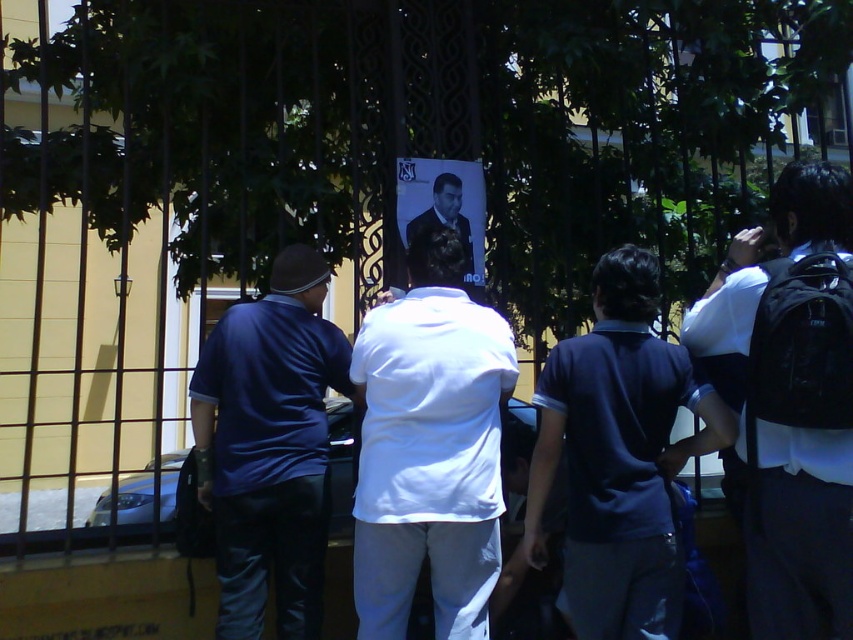
Question: Is white matte shirt at center smaller than dark suit at center?

Choices:
 (A) yes
 (B) no

Answer: (B)

Question: Which object is the farthest from the dark suit at center?

Choices:
 (A) matte blue shirt at center
 (B) white matte shirt at center
 (C) white matte shirt at right

Answer: (C)

Question: Which object is the closest to the dark suit at center?

Choices:
 (A) white matte shirt at right
 (B) white matte shirt at center

Answer: (B)

Question: Which of the following is the closest to the observer?

Choices:
 (A) (815, 401)
 (B) (286, 355)
 (C) (462, 220)
 (D) (375, 429)

Answer: (A)

Question: Can you confirm if white matte shirt at right is positioned to the left of matte blue shirt at center?

Choices:
 (A) yes
 (B) no

Answer: (B)

Question: Can you confirm if white matte shirt at right is positioned above matte blue shirt at center?

Choices:
 (A) yes
 (B) no

Answer: (A)